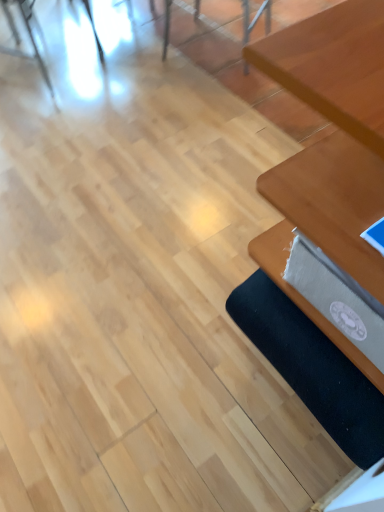
Locate an element on the screen. The width and height of the screenshot is (384, 512). free space to the left of wooden chair at upper center, which is counted as the 2th chair, starting from the left is located at coordinates (145, 64).